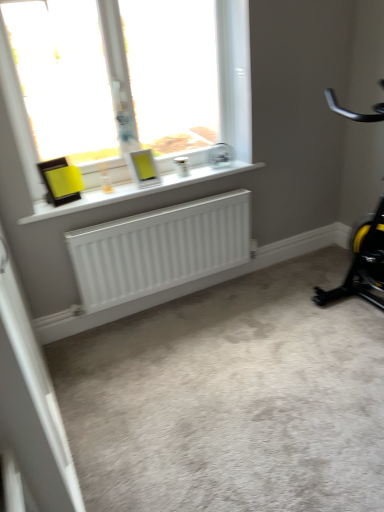
Question: Can you confirm if white plastic window at upper center is positioned to the left of black/yellow plastic stationary bicycle at right?

Choices:
 (A) no
 (B) yes

Answer: (B)

Question: Is white plastic window at upper center turned away from black/yellow plastic stationary bicycle at right?

Choices:
 (A) no
 (B) yes

Answer: (A)

Question: From the image's perspective, would you say white plastic window at upper center is shown under black/yellow plastic stationary bicycle at right?

Choices:
 (A) no
 (B) yes

Answer: (A)

Question: Does white plastic window at upper center have a lesser width compared to black/yellow plastic stationary bicycle at right?

Choices:
 (A) no
 (B) yes

Answer: (B)

Question: Considering the relative sizes of white plastic window at upper center and black/yellow plastic stationary bicycle at right in the image provided, is white plastic window at upper center shorter than black/yellow plastic stationary bicycle at right?

Choices:
 (A) no
 (B) yes

Answer: (B)

Question: Considering the relative positions of white plastic window at upper center and black/yellow plastic stationary bicycle at right in the image provided, is white plastic window at upper center in front of black/yellow plastic stationary bicycle at right?

Choices:
 (A) no
 (B) yes

Answer: (A)

Question: Does white matte screen door at lower left appear on the left side of white plastic window at upper center?

Choices:
 (A) no
 (B) yes

Answer: (B)

Question: Would you say white plastic window at upper center is part of white matte screen door at lower left's contents?

Choices:
 (A) no
 (B) yes

Answer: (A)

Question: Is white matte screen door at lower left directly adjacent to white plastic window at upper center?

Choices:
 (A) no
 (B) yes

Answer: (A)

Question: Is white matte screen door at lower left positioned with its back to white plastic window at upper center?

Choices:
 (A) no
 (B) yes

Answer: (A)

Question: Is white matte screen door at lower left facing towards white plastic window at upper center?

Choices:
 (A) yes
 (B) no

Answer: (B)

Question: From a real-world perspective, is white matte screen door at lower left physically below white plastic window at upper center?

Choices:
 (A) no
 (B) yes

Answer: (B)

Question: Does white matte screen door at lower left have a smaller size compared to white matte radiator at lower center?

Choices:
 (A) yes
 (B) no

Answer: (A)